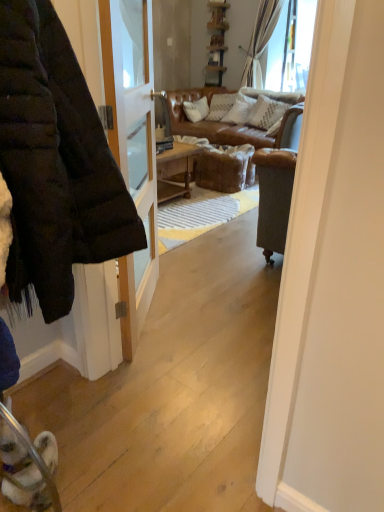
What do you see at coordinates (266, 112) in the screenshot?
I see `white textured pillow at center` at bounding box center [266, 112].

This screenshot has width=384, height=512. In order to click on white textured pillow at center in this screenshot , I will do `click(266, 112)`.

This screenshot has height=512, width=384. What do you see at coordinates (55, 163) in the screenshot?
I see `matte black jacket at left` at bounding box center [55, 163].

Measure the distance between point (24, 52) and camera.

The distance of point (24, 52) from camera is 72.60 centimeters.

You are a GUI agent. You are given a task and a screenshot of the screen. Output one action in this format:
    pyautogui.click(x=<x>, y=<y>)
    Task: Click on the matte black jacket at left
    The image size is (384, 512).
    Given the screenshot: What is the action you would take?
    pyautogui.click(x=55, y=163)

Where is `white textured pillow at center`? white textured pillow at center is located at coordinates (266, 112).

Does matte black jacket at left appear on the right side of white textured pillow at center?

Incorrect, matte black jacket at left is not on the right side of white textured pillow at center.

Which object is more forward, matte black jacket at left or white textured pillow at center?

matte black jacket at left is closer to the camera.

Which is closer, [50,130] or [272,121]?

Point [50,130] is closer to the camera than point [272,121].

From the image's perspective, does matte black jacket at left appear lower than white textured pillow at center?

Yes, from the image's perspective, matte black jacket at left is below white textured pillow at center.

From a real-world perspective, who is located higher, matte black jacket at left or white textured pillow at center?

From a 3D spatial view, matte black jacket at left is above.

Which of these two, matte black jacket at left or white textured pillow at center, is thinner?

Thinner between the two is white textured pillow at center.

In terms of height, does matte black jacket at left look taller or shorter compared to white textured pillow at center?

In the image, matte black jacket at left appears to be taller than white textured pillow at center.

Is matte black jacket at left smaller than white textured pillow at center?

No.

Which is correct: matte black jacket at left is inside white textured pillow at center, or outside of it?

matte black jacket at left is outside white textured pillow at center.

Is matte black jacket at left in contact with white textured pillow at center?

matte black jacket at left and white textured pillow at center are not in contact.

Is matte black jacket at left oriented away from white textured pillow at center?

No, white textured pillow at center is not at the back of matte black jacket at left.

At what (x,y) coordinates should I click in order to perform the action: click on jacket on the left of white textured pillow at center. Please return your answer as a coordinate pair (x, y). Looking at the image, I should click on (55, 163).

Is white textured pillow at center at the right side of matte black jacket at left?

Yes.

Which is in front, white textured pillow at center or matte black jacket at left?

matte black jacket at left is closer to the camera.

Which point is more forward, (271,122) or (21,95)?

The point (21,95) is in front.

From the image's perspective, which one is positioned higher, white textured pillow at center or matte black jacket at left?

From the image's view, white textured pillow at center is above.

From a real-world perspective, is white textured pillow at center on top of matte black jacket at left?

No, from a real-world perspective, white textured pillow at center is not on top of matte black jacket at left.

Between white textured pillow at center and matte black jacket at left, which one has larger width?

matte black jacket at left.

In terms of height, does white textured pillow at center look taller or shorter compared to matte black jacket at left?

Clearly, white textured pillow at center is shorter compared to matte black jacket at left.

Considering the sizes of objects white textured pillow at center and matte black jacket at left in the image provided, who is smaller, white textured pillow at center or matte black jacket at left?

white textured pillow at center.

Is white textured pillow at center inside the boundaries of matte black jacket at left, or outside?

white textured pillow at center exists outside the volume of matte black jacket at left.

Is white textured pillow at center positioned far away from matte black jacket at left?

That's right, there is a large distance between white textured pillow at center and matte black jacket at left.

Consider the image. Is white textured pillow at center positioned with its back to matte black jacket at left?

No, matte black jacket at left is not at the back of white textured pillow at center.

Based on the photo, how different are the orientations of white textured pillow at center and matte black jacket at left in degrees?

81.1 degrees.

Measure the distance from white textured pillow at center to matte black jacket at left.

The distance of white textured pillow at center from matte black jacket at left is 4.09 meters.

Where is `pillow on the right of matte black jacket at left`? The width and height of the screenshot is (384, 512). pillow on the right of matte black jacket at left is located at coordinates (266, 112).

At what (x,y) coordinates should I click in order to perform the action: click on jacket below the white textured pillow at center (from the image's perspective). Please return your answer as a coordinate pair (x, y). This screenshot has height=512, width=384. Looking at the image, I should click on tap(55, 163).

Find the location of a particular element. pillow located on the right of matte black jacket at left is located at coordinates (266, 112).